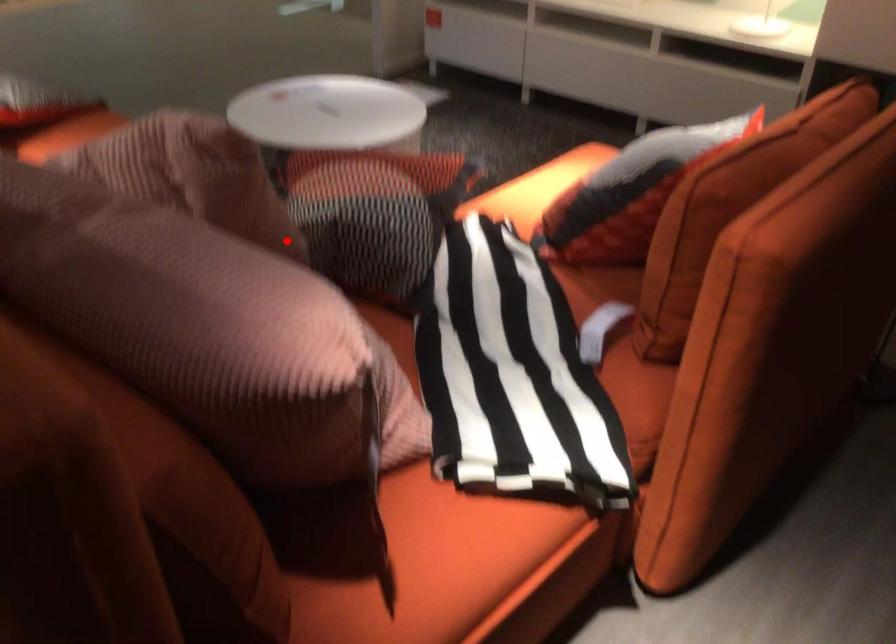
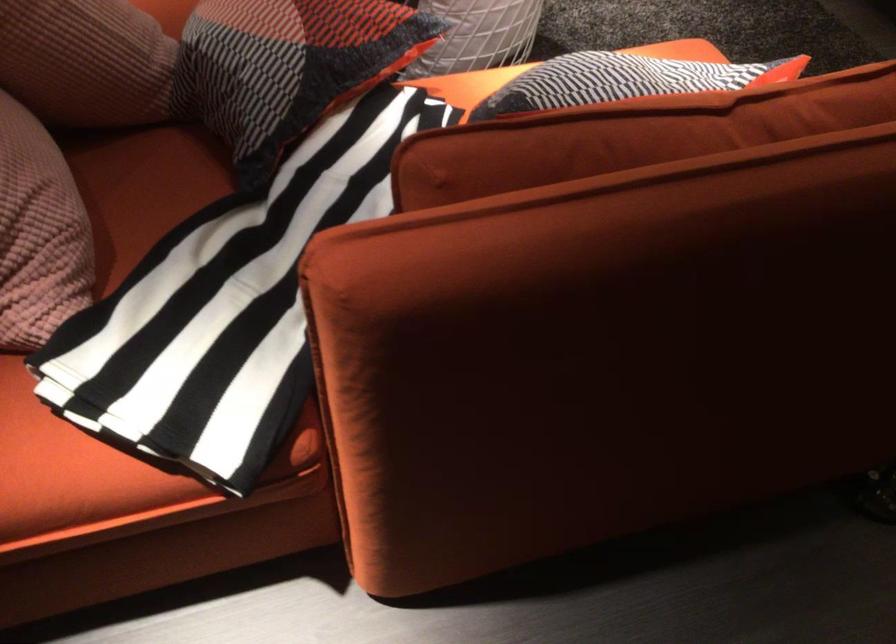
In the second image, find the point that corresponds to the highlighted location in the first image.

(85, 61)